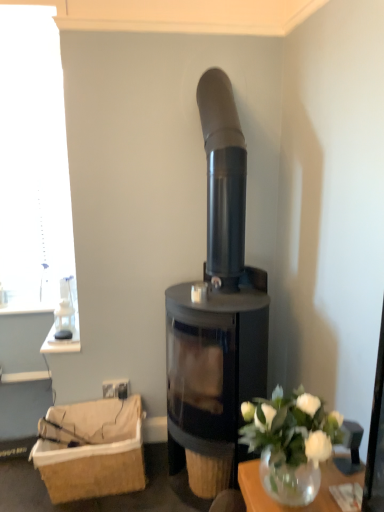
Question: Considering the relative sizes of matte black wood burning stove at center and white glass vase at lower right in the image provided, is matte black wood burning stove at center taller than white glass vase at lower right?

Choices:
 (A) no
 (B) yes

Answer: (B)

Question: Considering the relative sizes of matte black wood burning stove at center and white glass vase at lower right in the image provided, is matte black wood burning stove at center bigger than white glass vase at lower right?

Choices:
 (A) no
 (B) yes

Answer: (B)

Question: Does matte black wood burning stove at center appear on the right side of white glass vase at lower right?

Choices:
 (A) no
 (B) yes

Answer: (A)

Question: From the image's perspective, is matte black wood burning stove at center located beneath white glass vase at lower right?

Choices:
 (A) no
 (B) yes

Answer: (A)

Question: Is matte black wood burning stove at center closer to the viewer compared to white glass vase at lower right?

Choices:
 (A) no
 (B) yes

Answer: (A)

Question: Can you confirm if matte black wood burning stove at center is smaller than white glass vase at lower right?

Choices:
 (A) yes
 (B) no

Answer: (B)

Question: Does white glass vase at lower right lie in front of brown woven basket at lower left?

Choices:
 (A) no
 (B) yes

Answer: (B)

Question: Is white glass vase at lower right beside brown woven basket at lower left?

Choices:
 (A) yes
 (B) no

Answer: (B)

Question: Is white glass vase at lower right facing away from brown woven basket at lower left?

Choices:
 (A) yes
 (B) no

Answer: (B)

Question: Can you confirm if white glass vase at lower right is taller than brown woven basket at lower left?

Choices:
 (A) yes
 (B) no

Answer: (B)

Question: From the image's perspective, is white glass vase at lower right beneath brown woven basket at lower left?

Choices:
 (A) yes
 (B) no

Answer: (B)

Question: Is white glass vase at lower right smaller than brown woven basket at lower left?

Choices:
 (A) no
 (B) yes

Answer: (B)

Question: From the image's perspective, is brown woven basket at lower left under white glass vase at lower right?

Choices:
 (A) no
 (B) yes

Answer: (B)